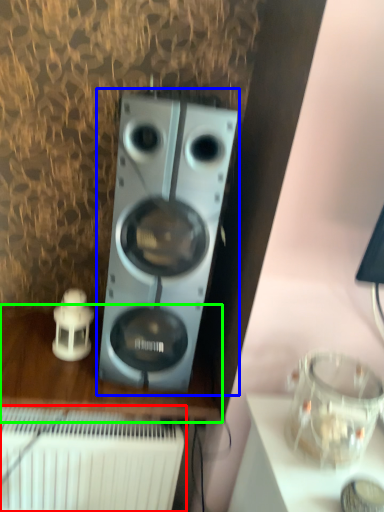
Question: Estimate the real-world distances between objects in this image. Which object is farther from radiator (highlighted by a red box), home appliance (highlighted by a blue box) or furniture (highlighted by a green box)?

Choices:
 (A) home appliance
 (B) furniture

Answer: (A)